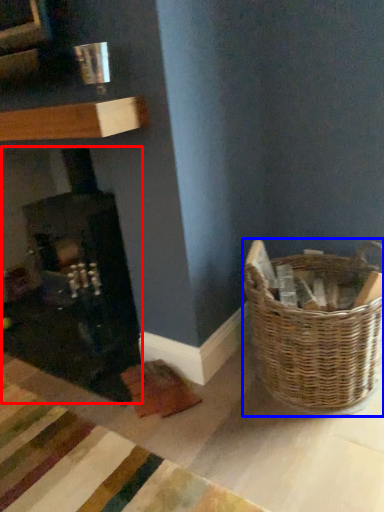
Question: Which object is further to the camera taking this photo, fireplace (highlighted by a red box) or picnic basket (highlighted by a blue box)?

Choices:
 (A) fireplace
 (B) picnic basket

Answer: (A)